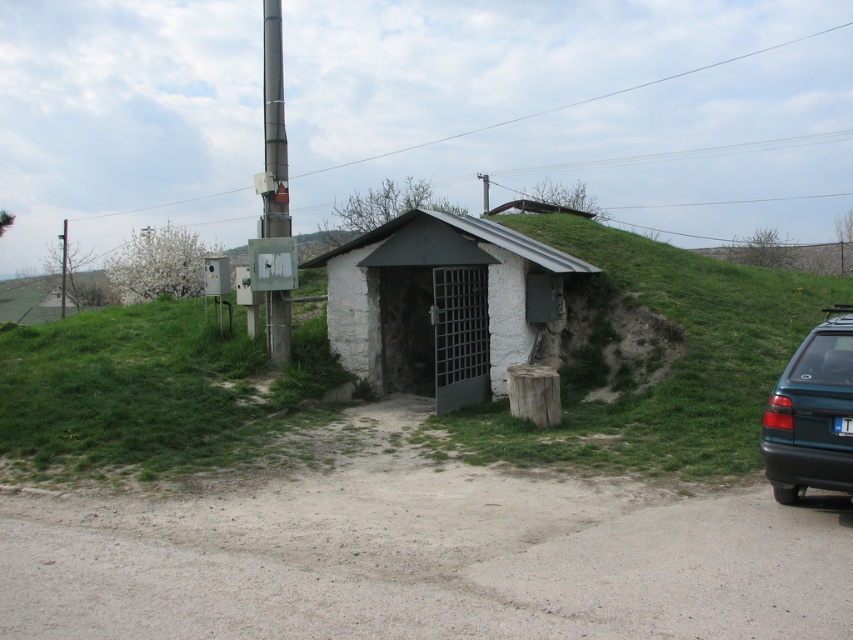
You are standing at the point marked by the coordinates (440, 304) in the image. Which object are you directly in front of?

You are directly in front of the white stucco hut at center, as the point (440, 304) represents its location.

You are standing at the entrance of the bunker and need to reach the white plastic license plate at right to read its details. The green grassy area at center is in your way. Can you walk straight ahead from the entrance to the license plate without stepping on the green grassy at center?

The green grassy at center is 8.21 meters away from the white plastic license plate at right. Since the distance is significant, you can walk around the green grassy at center to reach the license plate without stepping on it. Alternatively, if the path allows, you might navigate around the area to avoid the grass.

You are a delivery driver who needs to park your teal matte hatchback at right near the entrance of the bunker. However, there is a white plastic license plate at right in the way. Can you park your vehicle there without overlapping the license plate?

The teal matte hatchback at right is positioned over white plastic license plate at right, so parking there would overlap the license plate. Choose another spot.